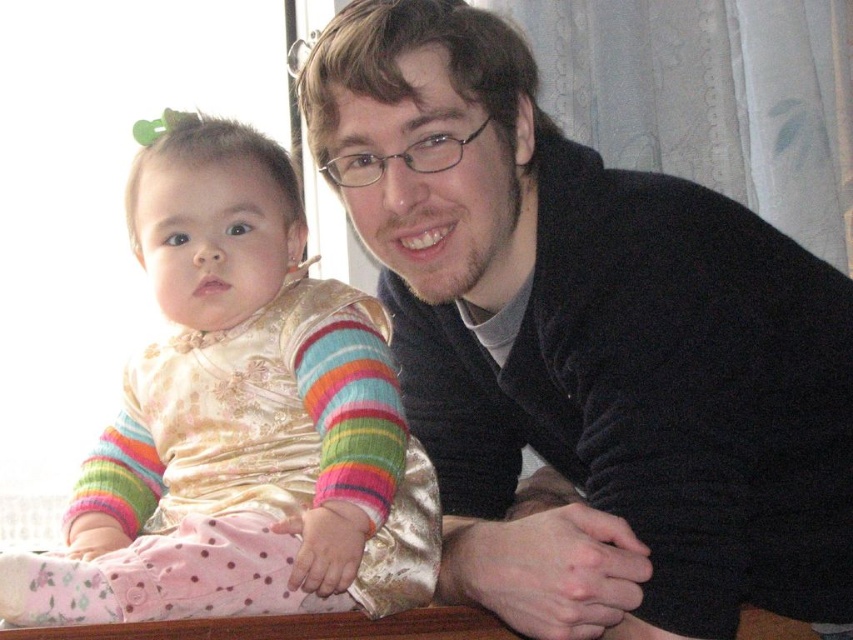
Question: Which point is closer to the camera?

Choices:
 (A) (746, 604)
 (B) (260, 444)

Answer: (A)

Question: Which point is closer to the camera taking this photo?

Choices:
 (A) (602, 474)
 (B) (250, 413)

Answer: (A)

Question: Is black velvet sweater at upper right thinner than silky gold dress at left?

Choices:
 (A) no
 (B) yes

Answer: (A)

Question: Does black velvet sweater at upper right appear on the left side of silky gold dress at left?

Choices:
 (A) yes
 (B) no

Answer: (B)

Question: From the image, what is the correct spatial relationship of black velvet sweater at upper right in relation to silky gold dress at left?

Choices:
 (A) below
 (B) above

Answer: (B)